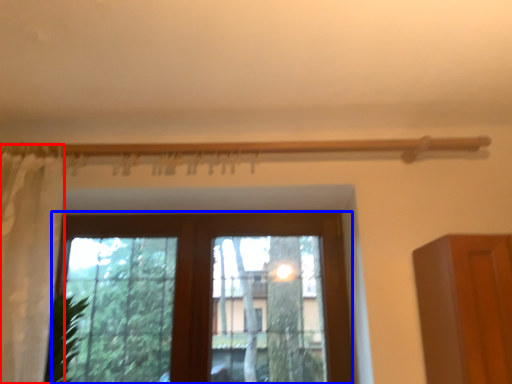
Question: Among these objects, which one is nearest to the camera, curtain (highlighted by a red box) or window (highlighted by a blue box)?

Choices:
 (A) curtain
 (B) window

Answer: (A)